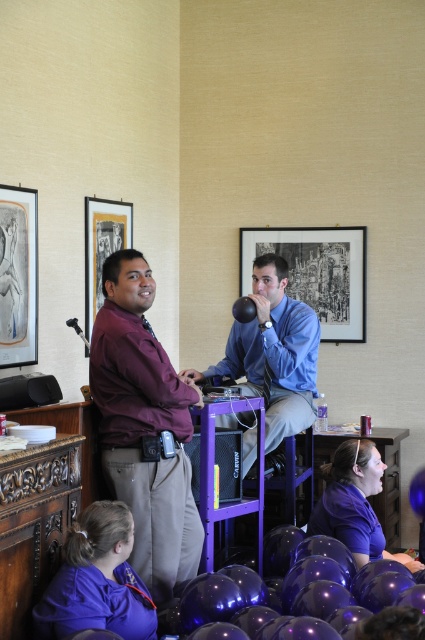
Who is positioned more to the right, shiny purple balloon at lower center or metallic silver microphone at left?

From the viewer's perspective, shiny purple balloon at lower center appears more on the right side.

Based on the photo, is shiny purple balloon at lower center smaller than metallic silver microphone at left?

Actually, shiny purple balloon at lower center might be larger than metallic silver microphone at left.

This screenshot has width=425, height=640. What do you see at coordinates (285, 579) in the screenshot?
I see `shiny purple balloon at lower center` at bounding box center [285, 579].

You are a GUI agent. You are given a task and a screenshot of the screen. Output one action in this format:
    pyautogui.click(x=<x>, y=<y>)
    Task: Click on the shiny purple balloon at lower center
    The width and height of the screenshot is (425, 640).
    Given the screenshot: What is the action you would take?
    pyautogui.click(x=285, y=579)

Does matte black picture frame at upper left lie in front of glossy black balloon at center?

No, it is behind glossy black balloon at center.

Who is higher up, matte black picture frame at upper left or glossy black balloon at center?

matte black picture frame at upper left is higher up.

Image resolution: width=425 pixels, height=640 pixels. Describe the element at coordinates (102, 246) in the screenshot. I see `matte black picture frame at upper left` at that location.

Where is `matte black picture frame at upper left`? This screenshot has width=425, height=640. matte black picture frame at upper left is located at coordinates (102, 246).

Between blue fabric shirt at center and matte black picture frame at upper center, which one appears on the right side from the viewer's perspective?

matte black picture frame at upper center

At what (x,y) coordinates should I click in order to perform the action: click on blue fabric shirt at center. Please return your answer as a coordinate pair (x, y). The height and width of the screenshot is (640, 425). Looking at the image, I should click on (272, 353).

What do you see at coordinates (272, 353) in the screenshot? I see `blue fabric shirt at center` at bounding box center [272, 353].

At what (x,y) coordinates should I click in order to perform the action: click on blue fabric shirt at center. Please return your answer as a coordinate pair (x, y). Looking at the image, I should click on (272, 353).